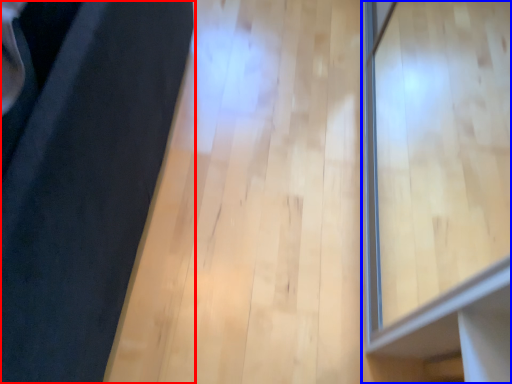
Question: Which of the following is the closest to the observer, furniture (highlighted by a red box) or window (highlighted by a blue box)?

Choices:
 (A) furniture
 (B) window

Answer: (A)